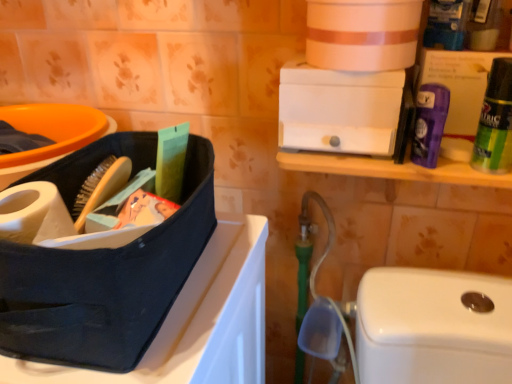
Question: Based on their positions, is matte black lunch box at left located to the left or right of purple matte deodorant at upper right?

Choices:
 (A) left
 (B) right

Answer: (A)

Question: Looking at their shapes, would you say matte black lunch box at left is wider or thinner than purple matte deodorant at upper right?

Choices:
 (A) thin
 (B) wide

Answer: (B)

Question: Estimate the real-world distances between objects in this image. Which object is farther from the matte black lunch box at left?

Choices:
 (A) purple matte deodorant at upper right, which is the 1th cleaning product from left to right
 (B) green matte fabric softener at upper right, the 2th cleaning product positioned from the left
 (C) white plastic drawer at upper center
 (D) purple matte deodorant at upper right

Answer: (B)

Question: Which is farther from the purple matte deodorant at upper right, positioned as the 2th cleaning product in right-to-left order?

Choices:
 (A) purple matte deodorant at upper right
 (B) white plastic drawer at upper center
 (C) matte black lunch box at left
 (D) green matte fabric softener at upper right, the 2th cleaning product positioned from the left

Answer: (C)